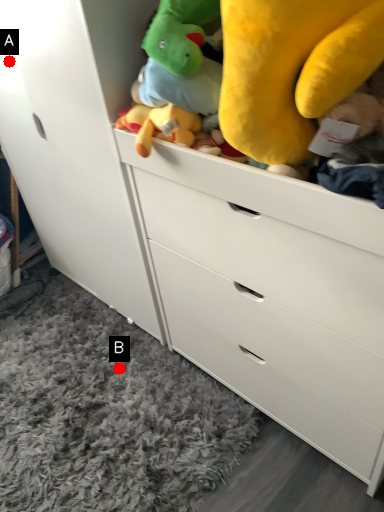
Question: Two points are circled on the image, labeled by A and B beside each circle. Which point appears closest to the camera in this image?

Choices:
 (A) A is closer
 (B) B is closer

Answer: (A)